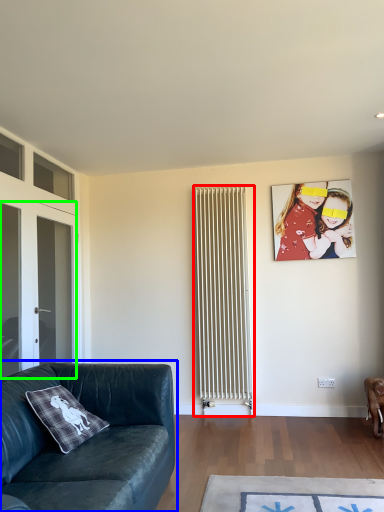
Question: Based on their relative distances, which object is farther from radiator (highlighted by a red box)? Choose from studio couch (highlighted by a blue box) and glass door (highlighted by a green box).

Choices:
 (A) studio couch
 (B) glass door

Answer: (A)